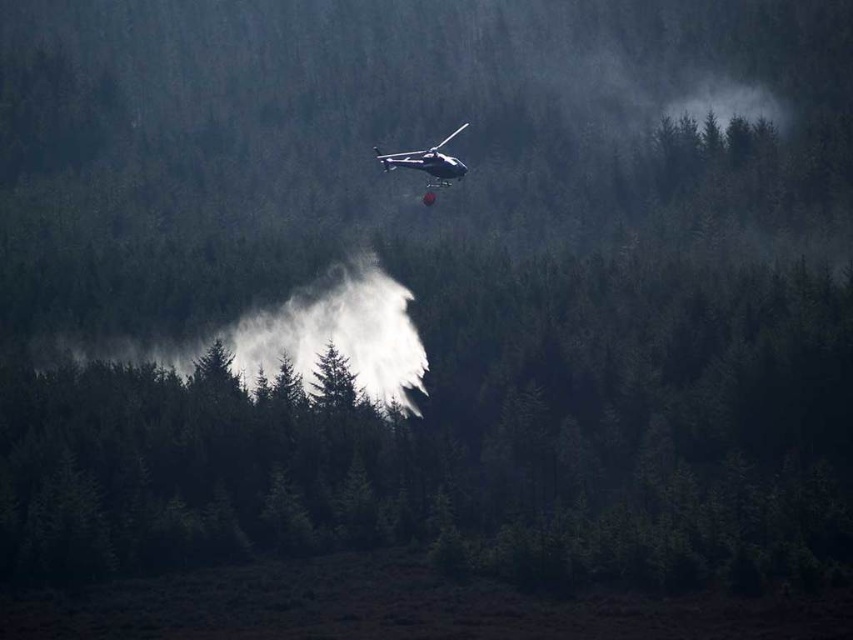
Between white matte smoke at center and metallic silver helicopter at center, which one appears on the right side from the viewer's perspective?

metallic silver helicopter at center is more to the right.

Is white matte smoke at center closer to the viewer compared to metallic silver helicopter at center?

That is False.

Measure the distance between white matte smoke at center and camera.

white matte smoke at center is 542.70 feet away from camera.

You are a GUI agent. You are given a task and a screenshot of the screen. Output one action in this format:
    pyautogui.click(x=<x>, y=<y>)
    Task: Click on the white matte smoke at center
    
    Given the screenshot: What is the action you would take?
    299,333